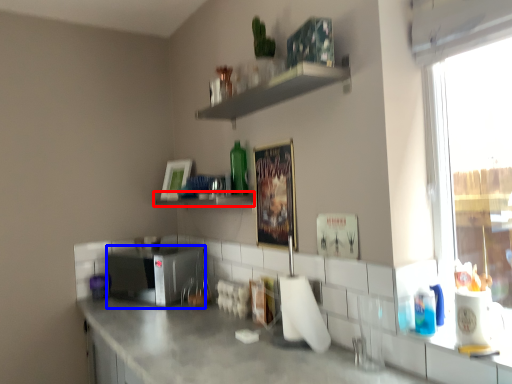
Question: Which object appears closest to the camera in this image, shelf (highlighted by a red box) or appliance (highlighted by a blue box)?

Choices:
 (A) shelf
 (B) appliance

Answer: (A)